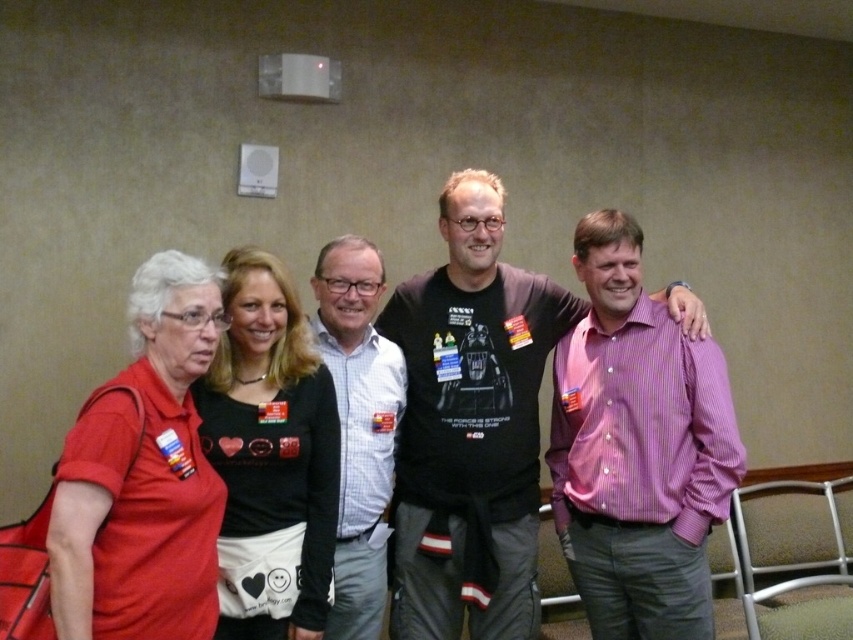
Which is more to the left, pink striped shirt at center or white striped shirt at center?

white striped shirt at center is more to the left.

Measure the distance between pink striped shirt at center and camera.

pink striped shirt at center is 2.09 meters from camera.

Find the location of a particular element. This screenshot has width=853, height=640. pink striped shirt at center is located at coordinates (637, 449).

Which of these two, black t-shirt at center or pink striped shirt at center, stands shorter?

pink striped shirt at center

Who is more distant from viewer, (463, 600) or (572, 404)?

Positioned behind is point (572, 404).

Is point (432, 540) positioned before point (624, 445)?

No, (432, 540) is further to viewer.

You are a GUI agent. You are given a task and a screenshot of the screen. Output one action in this format:
    pyautogui.click(x=<x>, y=<y>)
    Task: Click on the black t-shirt at center
    
    Given the screenshot: What is the action you would take?
    pyautogui.click(x=469, y=426)

This screenshot has height=640, width=853. I want to click on black t-shirt at center, so click(x=469, y=426).

Does point (480, 536) come in front of point (149, 465)?

No, it is behind (149, 465).

This screenshot has width=853, height=640. What do you see at coordinates (469, 426) in the screenshot? I see `black t-shirt at center` at bounding box center [469, 426].

The height and width of the screenshot is (640, 853). In order to click on black t-shirt at center in this screenshot , I will do `click(469, 426)`.